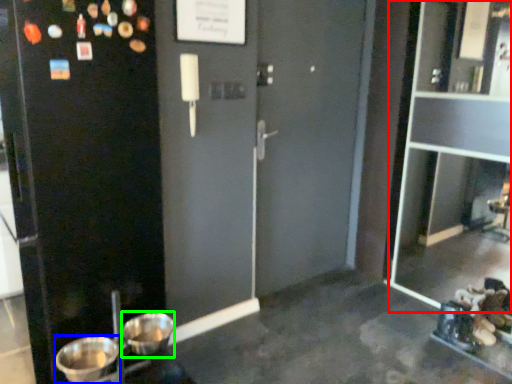
Question: Which is farther away from glass door (highlighted by a red box)? basin (highlighted by a blue box) or basin (highlighted by a green box)?

Choices:
 (A) basin
 (B) basin

Answer: (A)